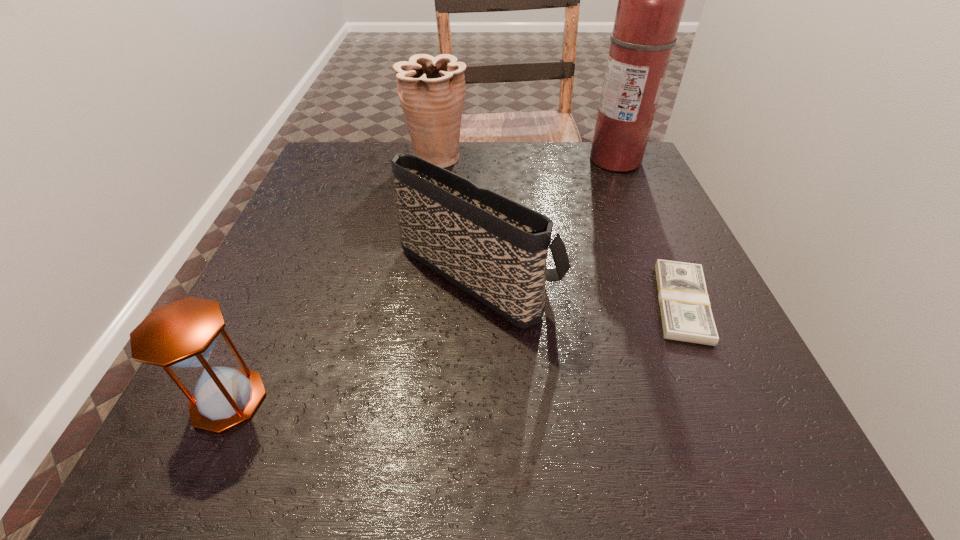
The image size is (960, 540). I want to click on the tallest object, so click(651, 0).

Image resolution: width=960 pixels, height=540 pixels. In order to click on urn in this screenshot , I will do `click(431, 90)`.

Where is `handbag`? This screenshot has height=540, width=960. handbag is located at coordinates (495, 249).

I want to click on the leftmost object, so click(x=182, y=334).

Find the location of a particular element. The image size is (960, 540). hourglass is located at coordinates (182, 334).

You are a GUI agent. You are given a task and a screenshot of the screen. Output one action in this format:
    pyautogui.click(x=<x>, y=<y>)
    Task: Click on the dollar
    The height and width of the screenshot is (540, 960).
    Given the screenshot: What is the action you would take?
    pyautogui.click(x=686, y=315)

Locate an element on the screen. vacant space located on the front-facing side of the tallest object is located at coordinates (538, 161).

Where is `vacant region located 0.400m on the front-facing side of the tallest object`? vacant region located 0.400m on the front-facing side of the tallest object is located at coordinates (430, 161).

Identify the location of vacant space situated 0.190m on the front-facing side of the tallest object. (514, 161).

Where is `vacant region located on the front of the urn`? Image resolution: width=960 pixels, height=540 pixels. vacant region located on the front of the urn is located at coordinates (426, 227).